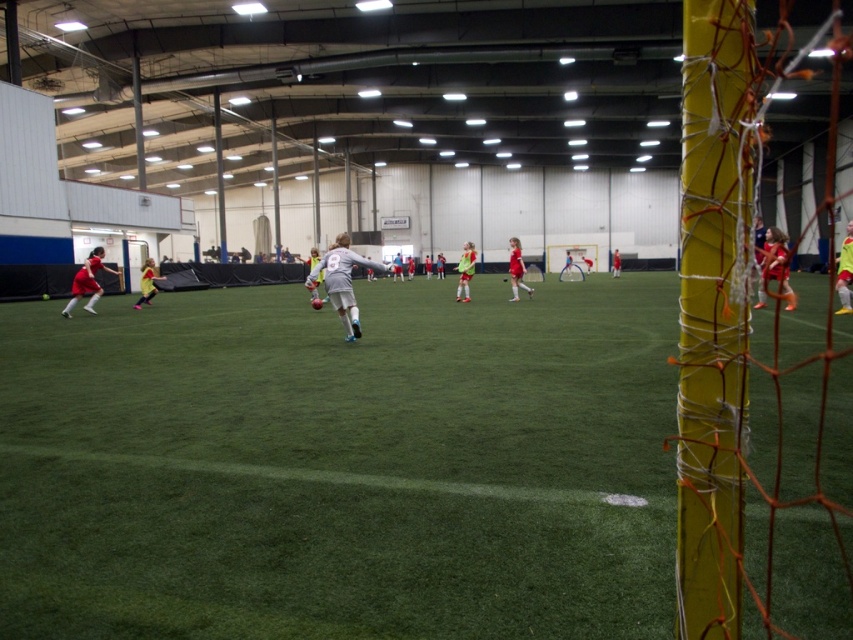
You are a soccer player wearing a yellow uniform and positioned at point (86, 282). You want to pass the ball to your teammate wearing a red jersey at left. Is the point you are standing on the correct location to pass to your teammate?

The point (86, 282) is on matte red jersey at left, so you are already standing on your teammate wearing a red jersey at left. Therefore, you don not need to pass the ball.

You are a soccer player positioned at point (141, 288) and want to pass the ball to a teammate located at point (91, 250). Considering the goalkeeper is near the goal on the right, which direction should you aim the pass to ensure it reaches your teammate without going towards the goal?

You should aim the pass towards point (91, 250), which is behind point (141, 288). Since point (91, 250) is behind point (141, 288), the pass will go in the opposite direction away from the goal, keeping it away from the goalkeeper near the right side of the frame.

You are a referee in the soccer match. You need to determine if the gray matte soccer ball at center is currently in a position that would allow a player in the matte red jersey at right to legally kick it. Based on their positions, is this possible?

The gray matte soccer ball at center is above matte red jersey at right, meaning the ball is positioned higher than the jersey. Since the ball is above the jersey, the player in the matte red jersey at right can legally kick it as long as they make contact while it is within playable height.